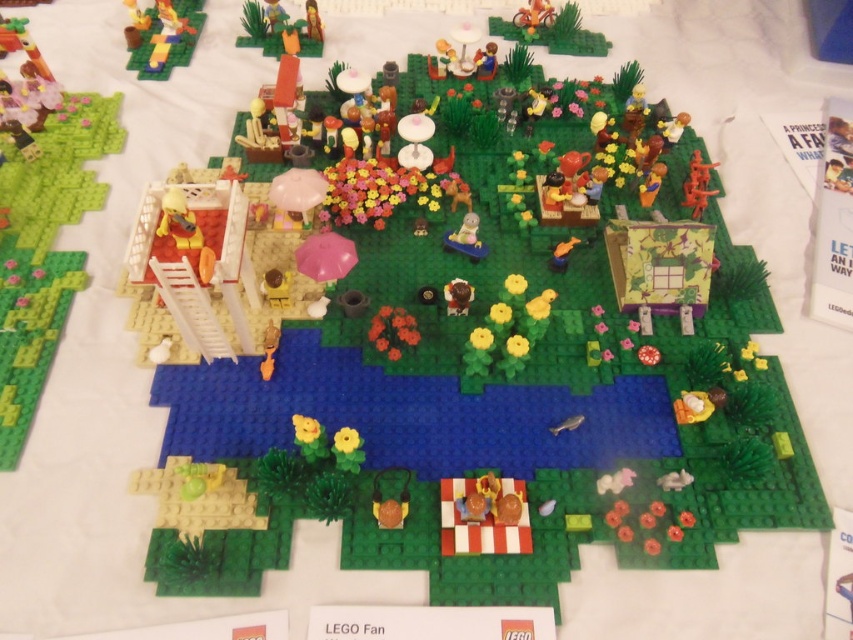
Does matte yellow figure at upper left have a greater height compared to brown matte teddy bear at center?

Yes.

Is matte yellow figure at upper left closer to the viewer compared to brown matte teddy bear at center?

No.

Is point (149, 8) farther from viewer compared to point (445, 304)?

Yes, it is behind point (445, 304).

This screenshot has width=853, height=640. In order to click on matte yellow figure at upper left in this screenshot , I will do `click(163, 36)`.